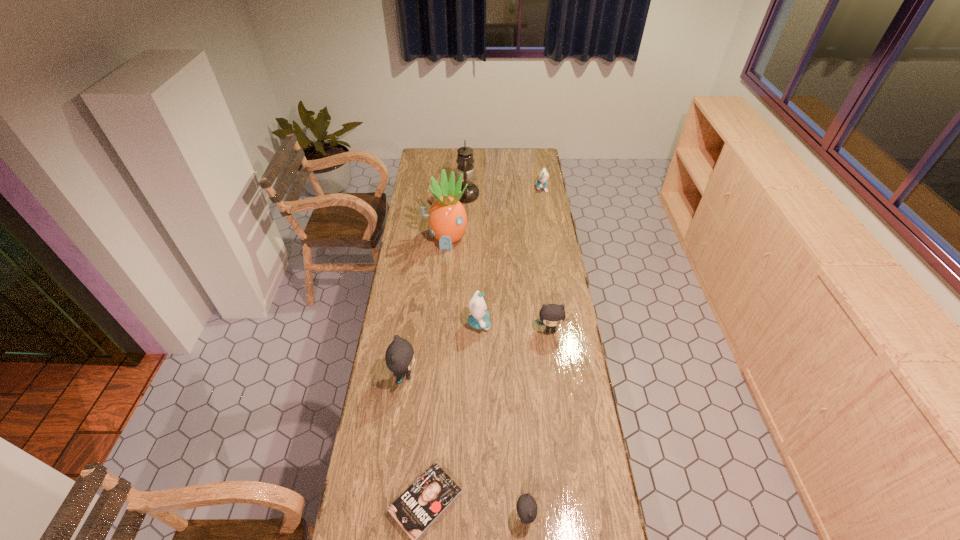
This screenshot has width=960, height=540. Find the location of `the smaller blue kitten`. the smaller blue kitten is located at coordinates (543, 176).

Where is `the nearest gray kitten`? The image size is (960, 540). the nearest gray kitten is located at coordinates 526,508.

This screenshot has width=960, height=540. I want to click on the second gray kitten from right to left, so click(526, 508).

Where is `vacant space located on the back of the oil lamp`? The height and width of the screenshot is (540, 960). vacant space located on the back of the oil lamp is located at coordinates (468, 156).

The height and width of the screenshot is (540, 960). In order to click on vacant space located 0.350m at the entrance of the pineapple in this screenshot , I will do `click(441, 308)`.

Where is `free space located 0.060m on the front-facing side of the second farthest gray kitten`? free space located 0.060m on the front-facing side of the second farthest gray kitten is located at coordinates (434, 375).

Locate an element on the screen. blank space located on the face of the nearer blue kitten is located at coordinates point(559,323).

Find the location of a particular element. The width and height of the screenshot is (960, 540). free point located on the front-facing side of the second biggest gray kitten is located at coordinates (552, 348).

Where is `vacant space located on the face of the smaller blue kitten`? vacant space located on the face of the smaller blue kitten is located at coordinates (514, 188).

The height and width of the screenshot is (540, 960). What are the coordinates of `blank space located 0.380m on the face of the smaller blue kitten` in the screenshot? It's located at (468, 188).